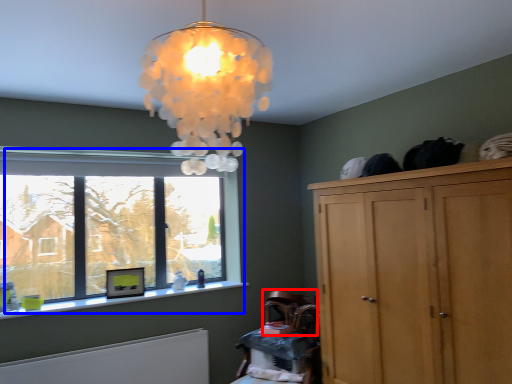
Question: Among these objects, which one is nearest to the camera, armchair (highlighted by a red box) or window (highlighted by a blue box)?

Choices:
 (A) armchair
 (B) window

Answer: (B)